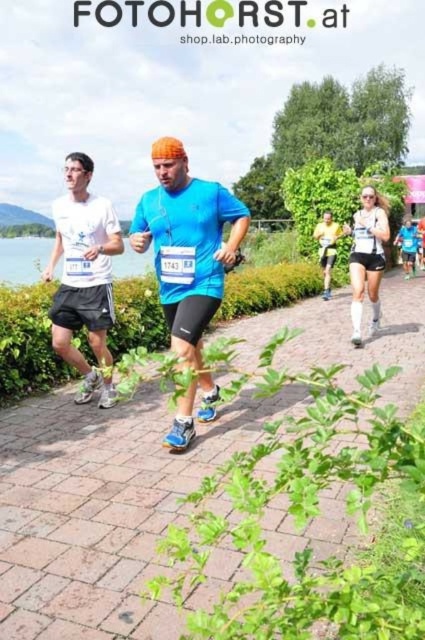
Question: Which of the following is the farthest from the observer?

Choices:
 (A) (155, 145)
 (B) (356, 312)
 (C) (62, 237)

Answer: (B)

Question: Is matte blue shirt at center to the left of matte white shorts at center from the viewer's perspective?

Choices:
 (A) no
 (B) yes

Answer: (B)

Question: Is brick pavement at center to the right of yellow fabric at center from the viewer's perspective?

Choices:
 (A) no
 (B) yes

Answer: (A)

Question: Which of the following is the closest to the observer?

Choices:
 (A) brick pavement at center
 (B) yellow fabric at center
 (C) matte white shorts at center

Answer: (A)

Question: Does matte blue shirt at center have a lesser width compared to matte white shorts at center?

Choices:
 (A) yes
 (B) no

Answer: (A)

Question: Which point is farther to the camera?

Choices:
 (A) white matte t-shirt at left
 (B) matte blue shirt at center
 (C) yellow fabric at center

Answer: (C)